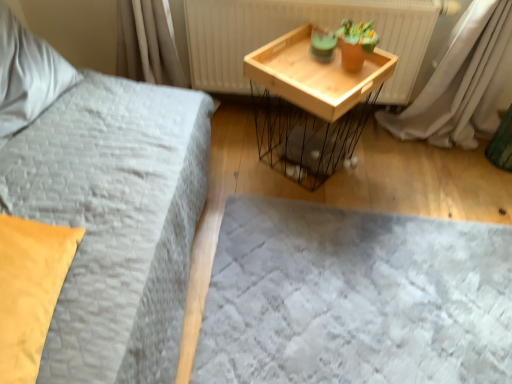
Question: Is wooden tray at center positioned behind soft white pillow at upper left, the first pillow when ordered from top to bottom?

Choices:
 (A) yes
 (B) no

Answer: (A)

Question: Does wooden tray at center have a lesser height compared to soft white pillow at upper left, the 1th pillow in the back-to-front sequence?

Choices:
 (A) yes
 (B) no

Answer: (B)

Question: From a real-world perspective, is wooden tray at center located beneath soft white pillow at upper left, the second pillow from the bottom?

Choices:
 (A) yes
 (B) no

Answer: (A)

Question: Considering the relative positions of wooden tray at center and soft white pillow at upper left, the 2th pillow in the right-to-left sequence, in the image provided, is wooden tray at center to the right of soft white pillow at upper left, the 2th pillow in the right-to-left sequence, from the viewer's perspective?

Choices:
 (A) yes
 (B) no

Answer: (A)

Question: Can you confirm if wooden tray at center is positioned to the left of soft white pillow at upper left, the 1th pillow from the left?

Choices:
 (A) yes
 (B) no

Answer: (B)

Question: Can you confirm if wooden tray at center is wider than soft white pillow at upper left, the first pillow when ordered from top to bottom?

Choices:
 (A) yes
 (B) no

Answer: (A)

Question: Is soft gray fabric bed frame at lower center smaller than wooden tray at center?

Choices:
 (A) yes
 (B) no

Answer: (A)

Question: Could you tell me if soft gray fabric bed frame at lower center is turned towards wooden tray at center?

Choices:
 (A) yes
 (B) no

Answer: (B)

Question: Is soft gray fabric bed frame at lower center looking in the opposite direction of wooden tray at center?

Choices:
 (A) yes
 (B) no

Answer: (B)

Question: Is soft gray fabric bed frame at lower center surrounding wooden tray at center?

Choices:
 (A) yes
 (B) no

Answer: (B)

Question: Is soft gray fabric bed frame at lower center closer to camera compared to wooden tray at center?

Choices:
 (A) yes
 (B) no

Answer: (A)

Question: Considering the relative positions of soft gray fabric bed frame at lower center and wooden tray at center in the image provided, is soft gray fabric bed frame at lower center to the left of wooden tray at center from the viewer's perspective?

Choices:
 (A) yes
 (B) no

Answer: (B)

Question: Does wooden tray at upper right have a greater width compared to soft gray fabric bed frame at lower center?

Choices:
 (A) no
 (B) yes

Answer: (A)